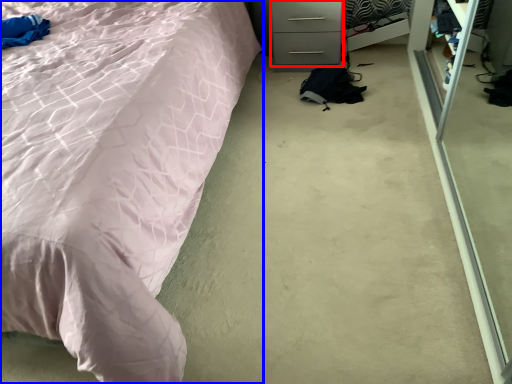
Question: Which object is closer to the camera taking this photo, drawer (highlighted by a red box) or bed (highlighted by a blue box)?

Choices:
 (A) drawer
 (B) bed

Answer: (B)